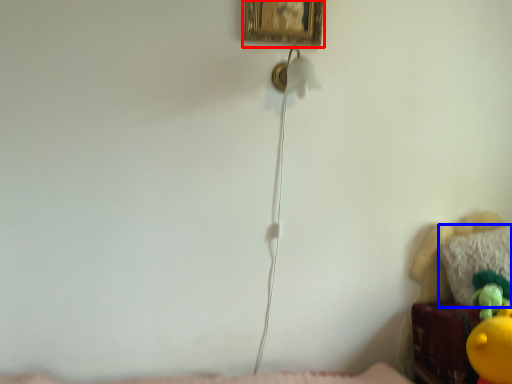
Question: Which point is closer to the camera, picture frame (highlighted by a red box) or pillow (highlighted by a blue box)?

Choices:
 (A) picture frame
 (B) pillow

Answer: (A)